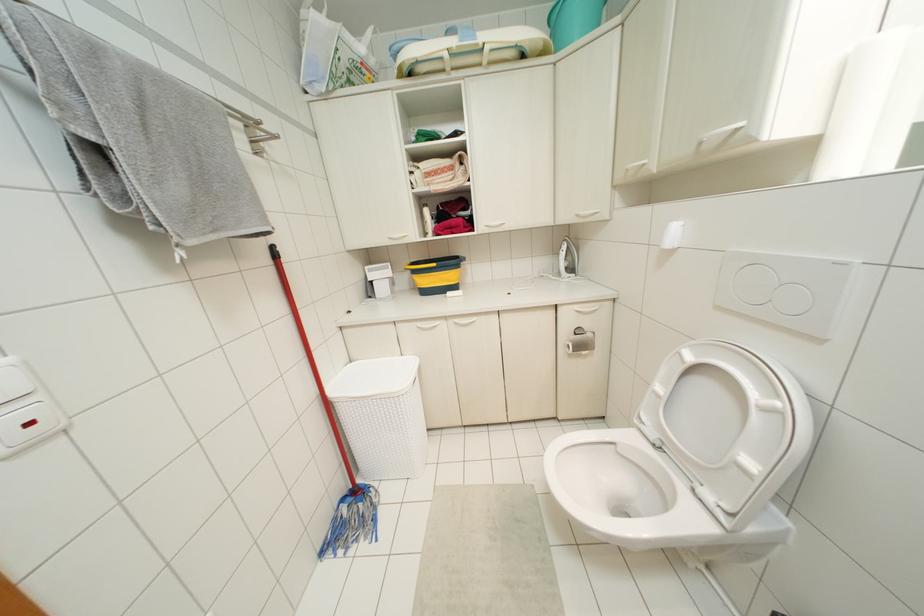
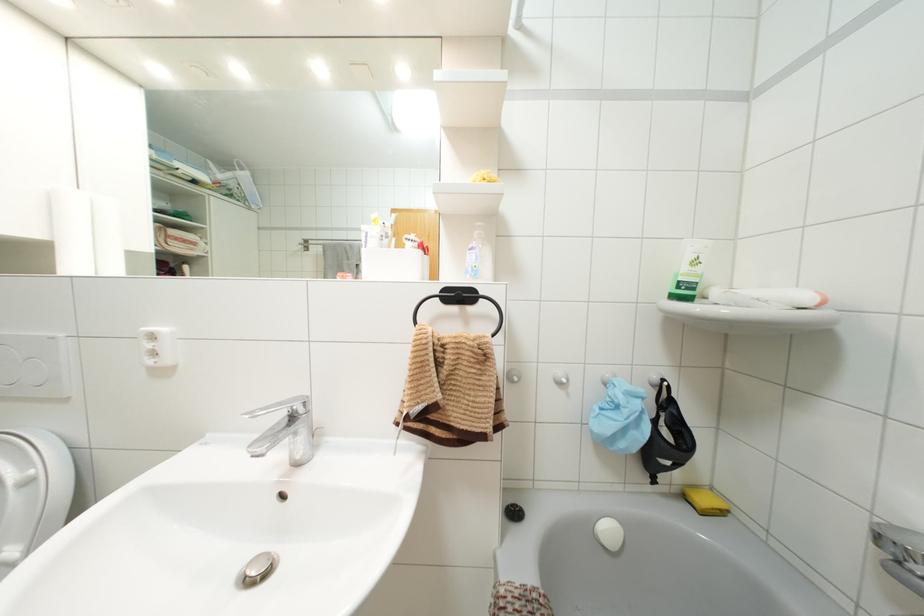
Question: Based on the continuous images, in which direction is the camera rotating? Reply with the corresponding letter.

Choices:
 (A) Left
 (B) Right
 (C) Up
 (D) Down

Answer: (B)